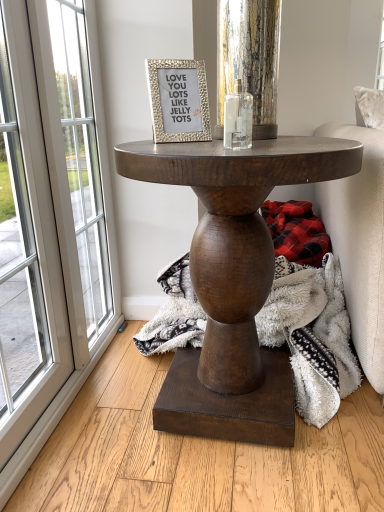
Question: From a real-world perspective, is white glass screen door at left on dark wood table at center?

Choices:
 (A) yes
 (B) no

Answer: (A)

Question: Considering the relative positions of white glass screen door at left and dark wood table at center in the image provided, is white glass screen door at left behind dark wood table at center?

Choices:
 (A) yes
 (B) no

Answer: (A)

Question: Does white glass screen door at left have a lesser width compared to dark wood table at center?

Choices:
 (A) yes
 (B) no

Answer: (A)

Question: Considering the relative sizes of white glass screen door at left and dark wood table at center in the image provided, is white glass screen door at left smaller than dark wood table at center?

Choices:
 (A) yes
 (B) no

Answer: (A)

Question: Is white glass screen door at left facing away from dark wood table at center?

Choices:
 (A) no
 (B) yes

Answer: (A)

Question: From the image's perspective, is gold textured frame at upper center positioned above or below white glass screen door at left?

Choices:
 (A) below
 (B) above

Answer: (B)

Question: Is gold textured frame at upper center wider or thinner than white glass screen door at left?

Choices:
 (A) thin
 (B) wide

Answer: (A)

Question: Considering the positions of point (155, 67) and point (31, 47), is point (155, 67) closer or farther from the camera than point (31, 47)?

Choices:
 (A) farther
 (B) closer

Answer: (A)

Question: Relative to white glass screen door at left, is gold textured frame at upper center in front or behind?

Choices:
 (A) front
 (B) behind

Answer: (A)

Question: Is dark wood table at center wider or thinner than white glass screen door at left?

Choices:
 (A) thin
 (B) wide

Answer: (B)

Question: Is dark wood table at center bigger or smaller than white glass screen door at left?

Choices:
 (A) big
 (B) small

Answer: (A)

Question: Would you say dark wood table at center is inside or outside white glass screen door at left?

Choices:
 (A) outside
 (B) inside

Answer: (A)

Question: From a real-world perspective, is dark wood table at center physically located above or below white glass screen door at left?

Choices:
 (A) above
 (B) below

Answer: (B)

Question: From the image's perspective, relative to clear glass candle holder at center, is plaid fabric at lower right above or below?

Choices:
 (A) above
 (B) below

Answer: (B)

Question: Is point (276, 251) closer or farther from the camera than point (226, 102)?

Choices:
 (A) closer
 (B) farther

Answer: (B)